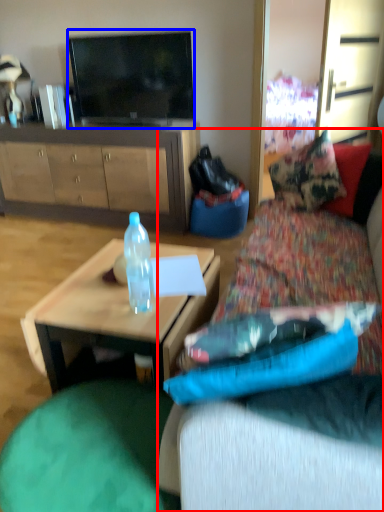
Question: Among these objects, which one is farthest to the camera, studio couch (highlighted by a red box) or television (highlighted by a blue box)?

Choices:
 (A) studio couch
 (B) television

Answer: (B)